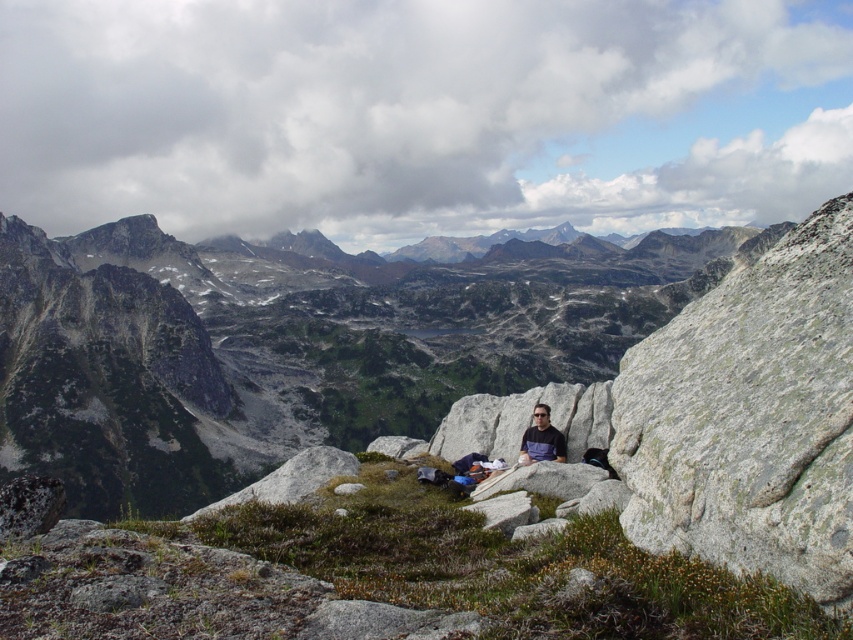
Question: Which point is closer to the camera taking this photo?

Choices:
 (A) (531, 426)
 (B) (776, 324)

Answer: (B)

Question: Does gray rock at center come in front of matte gray shirt at center?

Choices:
 (A) no
 (B) yes

Answer: (B)

Question: Does gray rock at center have a lesser width compared to matte gray shirt at center?

Choices:
 (A) no
 (B) yes

Answer: (A)

Question: Does gray rock at center appear on the right side of matte gray shirt at center?

Choices:
 (A) yes
 (B) no

Answer: (A)